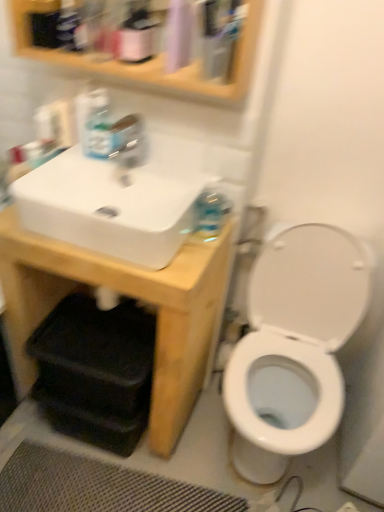
Question: From a real-world perspective, is transparent plastic tap at upper center physically below wooden medicine cabinet at upper center?

Choices:
 (A) yes
 (B) no

Answer: (A)

Question: Is transparent plastic tap at upper center thinner than wooden medicine cabinet at upper center?

Choices:
 (A) yes
 (B) no

Answer: (A)

Question: From the image's perspective, is transparent plastic tap at upper center under wooden medicine cabinet at upper center?

Choices:
 (A) no
 (B) yes

Answer: (B)

Question: Is transparent plastic tap at upper center taller than wooden medicine cabinet at upper center?

Choices:
 (A) no
 (B) yes

Answer: (A)

Question: Could you tell me if transparent plastic tap at upper center is turned towards wooden medicine cabinet at upper center?

Choices:
 (A) no
 (B) yes

Answer: (A)

Question: Can you confirm if transparent plastic tap at upper center is smaller than wooden medicine cabinet at upper center?

Choices:
 (A) yes
 (B) no

Answer: (A)

Question: From a real-world perspective, is wooden medicine cabinet at upper center physically above translucent plastic soap dispenser at upper left?

Choices:
 (A) yes
 (B) no

Answer: (A)

Question: Can you confirm if wooden medicine cabinet at upper center is thinner than translucent plastic soap dispenser at upper left?

Choices:
 (A) yes
 (B) no

Answer: (B)

Question: Could you tell me if wooden medicine cabinet at upper center is turned towards translucent plastic soap dispenser at upper left?

Choices:
 (A) yes
 (B) no

Answer: (B)

Question: Considering the relative positions of wooden medicine cabinet at upper center and translucent plastic soap dispenser at upper left in the image provided, is wooden medicine cabinet at upper center to the left of translucent plastic soap dispenser at upper left from the viewer's perspective?

Choices:
 (A) yes
 (B) no

Answer: (B)

Question: From the image's perspective, does wooden medicine cabinet at upper center appear higher than translucent plastic soap dispenser at upper left?

Choices:
 (A) yes
 (B) no

Answer: (A)

Question: Is wooden medicine cabinet at upper center far from translucent plastic soap dispenser at upper left?

Choices:
 (A) no
 (B) yes

Answer: (A)

Question: From the image's perspective, would you say matte pink spray bottle at upper center is shown under white glossy toilet at right?

Choices:
 (A) yes
 (B) no

Answer: (B)